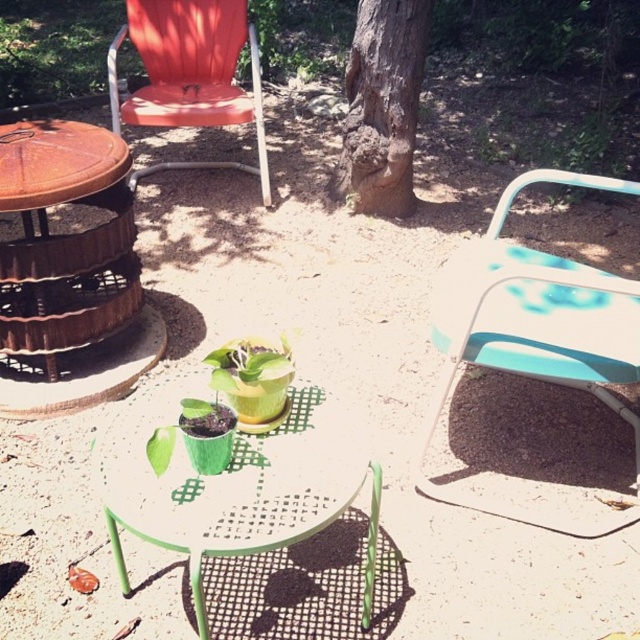
Question: Which object is positioned farthest from the green matte plant pot at center?

Choices:
 (A) teal plastic folding chair at upper right
 (B) orange plastic chair at upper left
 (C) brown rough bark tree at center

Answer: (B)

Question: Considering the relative positions of green matte plant pot at center and brown rough bark tree at center in the image provided, where is green matte plant pot at center located with respect to brown rough bark tree at center?

Choices:
 (A) below
 (B) above

Answer: (A)

Question: Which object is farther from the camera taking this photo?

Choices:
 (A) orange plastic chair at upper left
 (B) teal plastic folding chair at upper right
 (C) brown rough bark tree at center

Answer: (A)

Question: Can you confirm if teal plastic folding chair at upper right is positioned to the left of orange plastic chair at upper left?

Choices:
 (A) no
 (B) yes

Answer: (A)

Question: Which object is closer to the camera taking this photo?

Choices:
 (A) green matte plant pot at center
 (B) teal plastic folding chair at upper right
 (C) brown rough bark tree at center

Answer: (A)

Question: Considering the relative positions of teal plastic folding chair at upper right and brown rough bark tree at center in the image provided, where is teal plastic folding chair at upper right located with respect to brown rough bark tree at center?

Choices:
 (A) left
 (B) right

Answer: (B)